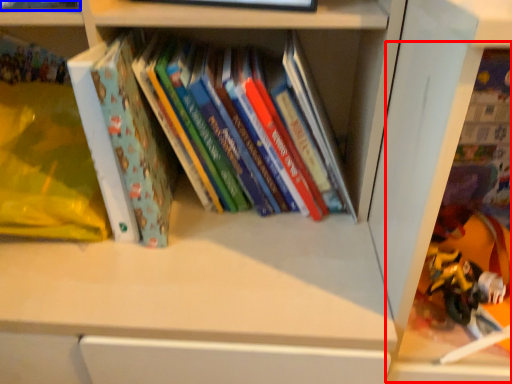
Question: Which object is further to the camera taking this photo, shelf (highlighted by a red box) or book (highlighted by a blue box)?

Choices:
 (A) shelf
 (B) book

Answer: (B)